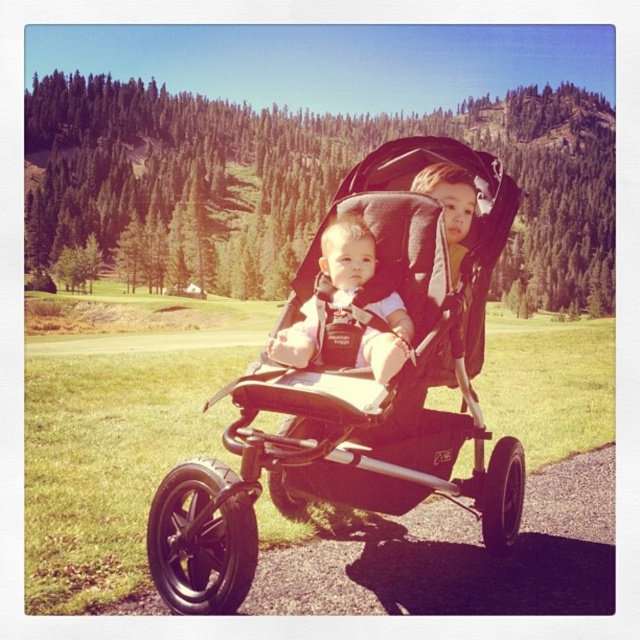
Question: Estimate the real-world distances between objects in this image. Which object is farther from the matte black baby at center?

Choices:
 (A) black fabric stroller at center
 (B) green grass at center

Answer: (B)

Question: Which object is closer to the camera taking this photo?

Choices:
 (A) green grass at center
 (B) matte black baby at center

Answer: (B)

Question: Is black fabric stroller at center in front of matte black baby at center?

Choices:
 (A) yes
 (B) no

Answer: (A)

Question: Considering the relative positions of green grass at center and matte black baby at center in the image provided, where is green grass at center located with respect to matte black baby at center?

Choices:
 (A) above
 (B) below

Answer: (B)

Question: Which point is closer to the camera?

Choices:
 (A) (401, 166)
 (B) (81, 579)

Answer: (B)

Question: Can you confirm if black fabric stroller at center is smaller than green grass at center?

Choices:
 (A) no
 (B) yes

Answer: (B)